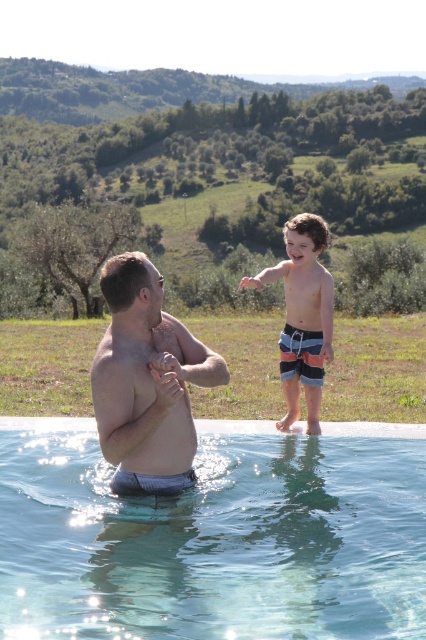
Looking at this image, can you confirm if clear glass water at center is positioned to the right of matte skin man at center?

Yes, clear glass water at center is to the right of matte skin man at center.

Identify the location of clear glass water at center. This screenshot has width=426, height=640. (215, 536).

Locate an element on the screen. The image size is (426, 640). clear glass water at center is located at coordinates (215, 536).

Is clear glass water at center above striped board shorts at upper right?

Actually, clear glass water at center is below striped board shorts at upper right.

Is point (288, 436) closer to camera compared to point (324, 234)?

Yes, it is in front of point (324, 234).

Locate an element on the screen. clear glass water at center is located at coordinates (215, 536).

Does point (167, 458) come behind point (288, 246)?

No, it is in front of (288, 246).

Is matte skin man at center below striped board shorts at upper right?

Indeed, matte skin man at center is positioned under striped board shorts at upper right.

Where is `matte skin man at center`? Image resolution: width=426 pixels, height=640 pixels. matte skin man at center is located at coordinates (146, 381).